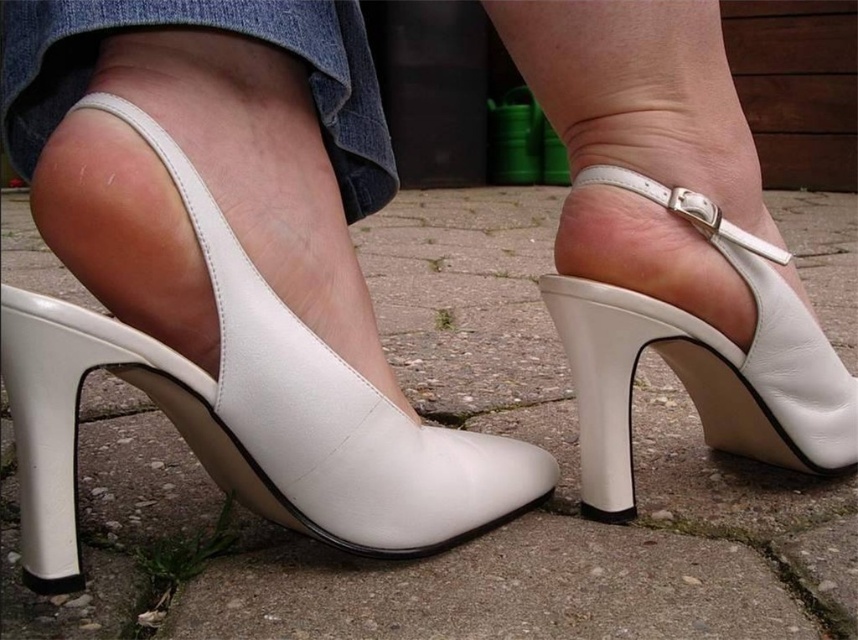
Is point (272, 298) less distant than point (748, 428)?

Yes.

Which is more to the left, white leather shoe at lower left or white leather high-heeled shoe at center?

white leather shoe at lower left is more to the left.

Image resolution: width=858 pixels, height=640 pixels. What do you see at coordinates (246, 413) in the screenshot?
I see `white leather shoe at lower left` at bounding box center [246, 413].

Locate an element on the screen. Image resolution: width=858 pixels, height=640 pixels. white leather shoe at lower left is located at coordinates (246, 413).